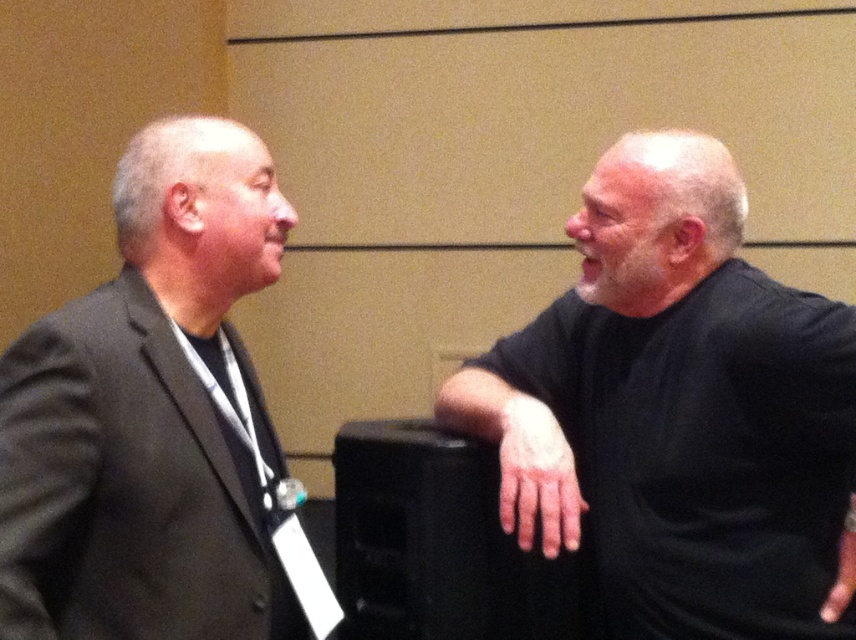
Question: Is black matte shirt at right positioned in front of black matte speaker at right?

Choices:
 (A) no
 (B) yes

Answer: (B)

Question: Which of these objects is positioned closest to the black matte shirt at right?

Choices:
 (A) pale skin/hair at right
 (B) dark gray suit at left

Answer: (A)

Question: Estimate the real-world distances between objects in this image. Which object is closer to the dark gray suit at left?

Choices:
 (A) matte black hand at right
 (B) black matte speaker at right

Answer: (B)

Question: Based on their relative distances, which object is nearer to the pale skin/hair at right?

Choices:
 (A) dark gray suit at left
 (B) black matte shirt at right
 (C) matte black hand at right
 (D) black matte speaker at right

Answer: (B)

Question: In this image, where is black matte speaker at right located relative to matte black hand at right?

Choices:
 (A) right
 (B) left

Answer: (B)

Question: Is black matte shirt at right thinner than dark gray suit at left?

Choices:
 (A) no
 (B) yes

Answer: (A)